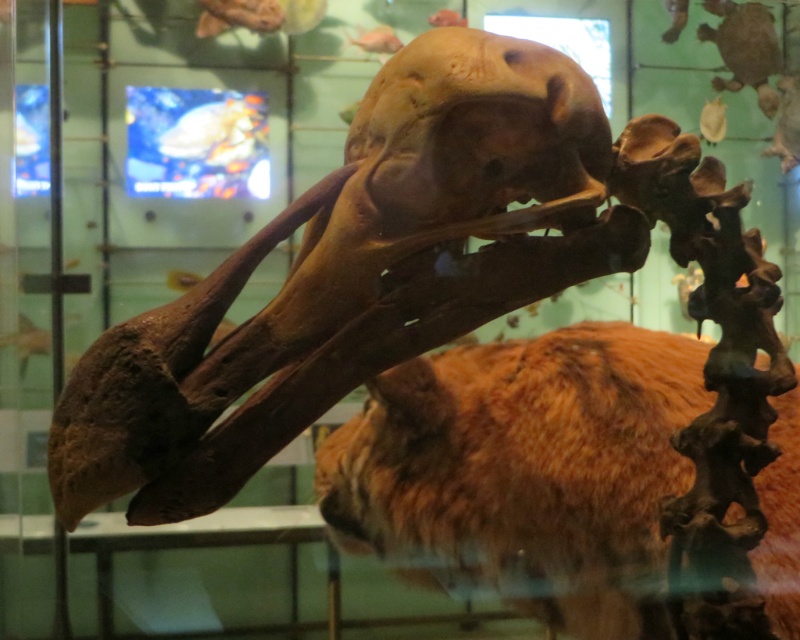
From the picture: You are a museum visitor standing in front of the mounted skeleton exhibit. You notice the brown matte skull at center. Can you estimate its position relative to the center of the exhibit using coordinates?

The brown matte skull at center is located at coordinates approximately 0.431 on the x axis and 0.444 on the y axis, which is slightly to the right and above the exact center of the exhibit.

You are a museum security guard who needs to inspect both the brown fuzzy fur at center and the brown matte skull at upper center. The security protocol requires you to check items in order of proximity from your current position. Which object should you check first?

The brown fuzzy fur at center should be checked first because it is closer to your current position than the brown matte skull at upper center, as they are 51.54 centimeters apart.